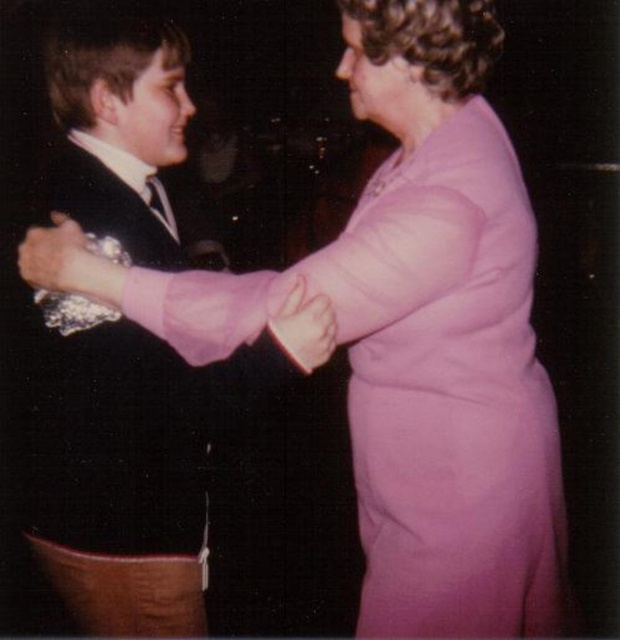
You are a photographer at a formal event and notice two items of interest in the scene described. The pink satin dress at center and the metallic silver bracelet at upper left. Can you determine which item is positioned higher in the frame?

The metallic silver bracelet at upper left is positioned higher than the pink satin dress at center, as the pink satin dress at center is located below it.